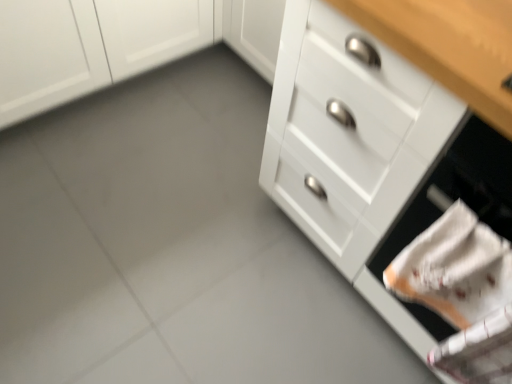
What do you see at coordinates (437, 218) in the screenshot? This screenshot has height=384, width=512. I see `white matte drawer at lower right` at bounding box center [437, 218].

Locate an element on the screen. This screenshot has width=512, height=384. white matte cabinet at upper left is located at coordinates (88, 46).

This screenshot has height=384, width=512. I want to click on white matte drawer at lower right, so click(x=437, y=218).

Are white matte cabinet at upper left and white glossy drawer at right located far from each other?

No, white matte cabinet at upper left is not far away from white glossy drawer at right.

Consider the image. From a real-world perspective, is white matte cabinet at upper left below white glossy drawer at right?

Yes, from a real-world perspective, white matte cabinet at upper left is below white glossy drawer at right.

Based on the photo, which object is closer to the camera taking this photo, white matte cabinet at upper left or white glossy drawer at right?

white glossy drawer at right.

Is white matte drawer at lower right to the left of white glossy drawer at right from the viewer's perspective?

In fact, white matte drawer at lower right is to the right of white glossy drawer at right.

Is white matte drawer at lower right taller than white glossy drawer at right?

No.

Would you consider white matte drawer at lower right to be distant from white glossy drawer at right?

They are positioned close to each other.

Which object is further away from the camera, white matte drawer at lower right or white glossy drawer at right?

white glossy drawer at right is further from the camera.

Considering the sizes of objects white matte drawer at lower right and white matte cabinet at upper left in the image provided, who is thinner, white matte drawer at lower right or white matte cabinet at upper left?

white matte cabinet at upper left is thinner.

Which object is further away from the camera, white matte drawer at lower right or white matte cabinet at upper left?

white matte cabinet at upper left is more distant.

Considering the relative sizes of white matte drawer at lower right and white matte cabinet at upper left in the image provided, is white matte drawer at lower right smaller than white matte cabinet at upper left?

Yes.

Which is behind, point (473, 162) or point (106, 28)?

Positioned behind is point (106, 28).

Considering the sizes of objects white matte cabinet at upper left and white matte drawer at lower right in the image provided, who is bigger, white matte cabinet at upper left or white matte drawer at lower right?

Bigger between the two is white matte cabinet at upper left.

Who is shorter, white matte cabinet at upper left or white matte drawer at lower right?

With less height is white matte cabinet at upper left.

At what (x,y) coordinates should I click in order to perform the action: click on cabinetry on the left of white matte drawer at lower right. Please return your answer as a coordinate pair (x, y). Looking at the image, I should click on (88, 46).

Between white matte cabinet at upper left and white matte drawer at lower right, which one has larger width?

With larger width is white matte drawer at lower right.

Does white glossy drawer at right come in front of white matte drawer at lower right?

No, the depth of white glossy drawer at right is greater than that of white matte drawer at lower right.

In the scene shown: Which of these two, white glossy drawer at right or white matte drawer at lower right, is wider?

With larger width is white matte drawer at lower right.

Is white glossy drawer at right touching white matte drawer at lower right?

No.

Which is behind, white glossy drawer at right or white matte cabinet at upper left?

white matte cabinet at upper left is further away from the camera.

Where is `the chest of drawers located above the white matte cabinet at upper left (from a real-world perspective)`? This screenshot has width=512, height=384. the chest of drawers located above the white matte cabinet at upper left (from a real-world perspective) is located at coordinates (373, 157).

From the picture: Which object is wider, white glossy drawer at right or white matte cabinet at upper left?

With larger width is white matte cabinet at upper left.

This screenshot has width=512, height=384. What are the coordinates of `the chest of drawers located in front of the white matte cabinet at upper left` in the screenshot? It's located at (373, 157).

This screenshot has height=384, width=512. Identify the location of oven located on the right of white glossy drawer at right. (437, 218).

Consider the image. Which object lies further to the anchor point white matte drawer at lower right, white glossy drawer at right or white matte cabinet at upper left?

white matte cabinet at upper left.

Looking at the image, which one is located closer to white matte drawer at lower right, white matte cabinet at upper left or white glossy drawer at right?

Among the two, white glossy drawer at right is located nearer to white matte drawer at lower right.

Considering their positions, is white matte drawer at lower right positioned further to white matte cabinet at upper left than white glossy drawer at right?

white matte drawer at lower right is positioned further to the anchor white matte cabinet at upper left.

Which object lies further to the anchor point white glossy drawer at right, white matte drawer at lower right or white matte cabinet at upper left?

The object further to white glossy drawer at right is white matte cabinet at upper left.

Considering their positions, is white glossy drawer at right positioned further to white matte cabinet at upper left than white matte drawer at lower right?

white matte drawer at lower right lies further to white matte cabinet at upper left than the other object.

Estimate the real-world distances between objects in this image. Which object is closer to white glossy drawer at right, white matte cabinet at upper left or white matte drawer at lower right?

white matte drawer at lower right is closer to white glossy drawer at right.

Identify the location of chest of drawers between white matte cabinet at upper left and white matte drawer at lower right. This screenshot has height=384, width=512. (373, 157).